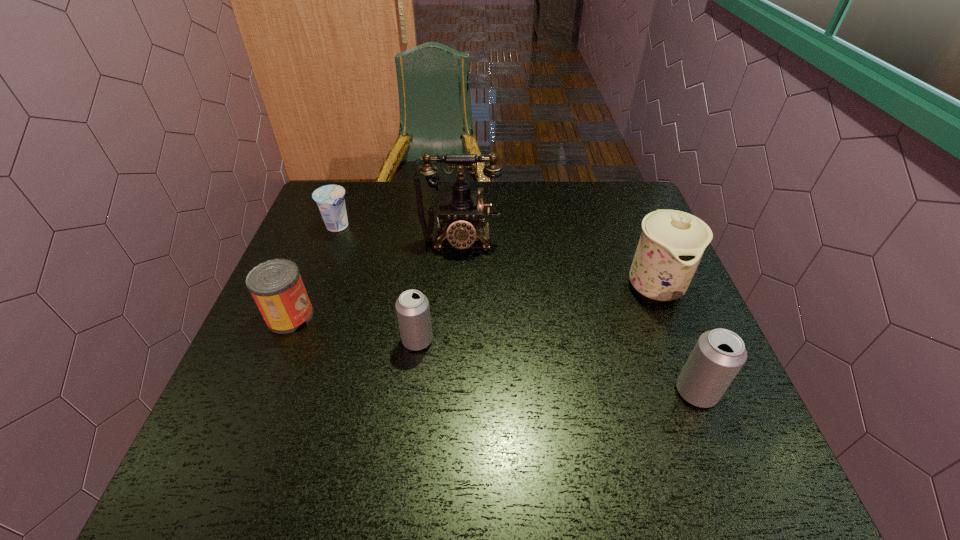
This screenshot has height=540, width=960. Identify the location of object that is the second closest to the tallest object. (412, 307).

I want to click on blank area in the image that satisfies the following two spatial constraints: 1. on the front side of the shorter beer can; 2. on the left side of the nearest object, so click(x=411, y=392).

The image size is (960, 540). I want to click on blank space that satisfies the following two spatial constraints: 1. on the rotary dial of the nearer beer can; 2. on the right side of the telephone, so click(452, 392).